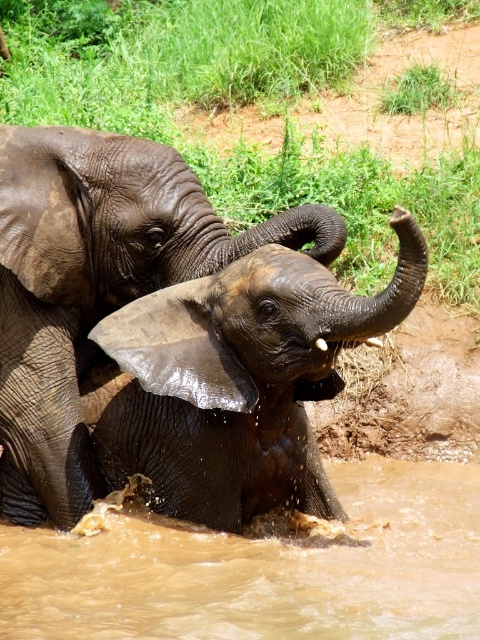
Can you confirm if brown muddy water at lower center is bigger than dark gray wet elephant at center?

Yes, brown muddy water at lower center is bigger than dark gray wet elephant at center.

Who is positioned more to the left, brown muddy water at lower center or dark gray wet elephant at center?

Positioned to the left is dark gray wet elephant at center.

Is point (423, 525) less distant than point (44, 356)?

No.

Locate an element on the screen. This screenshot has width=480, height=640. brown muddy water at lower center is located at coordinates (263, 570).